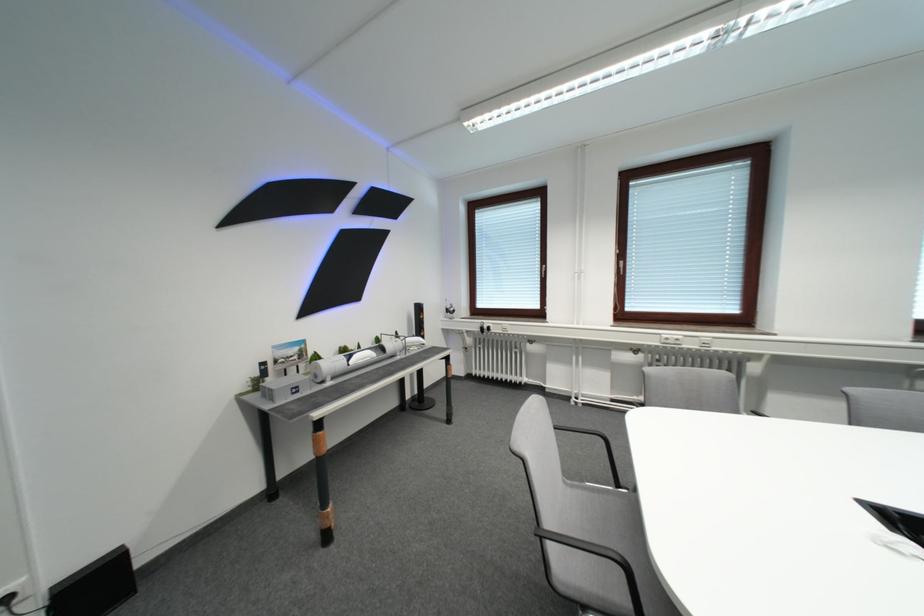
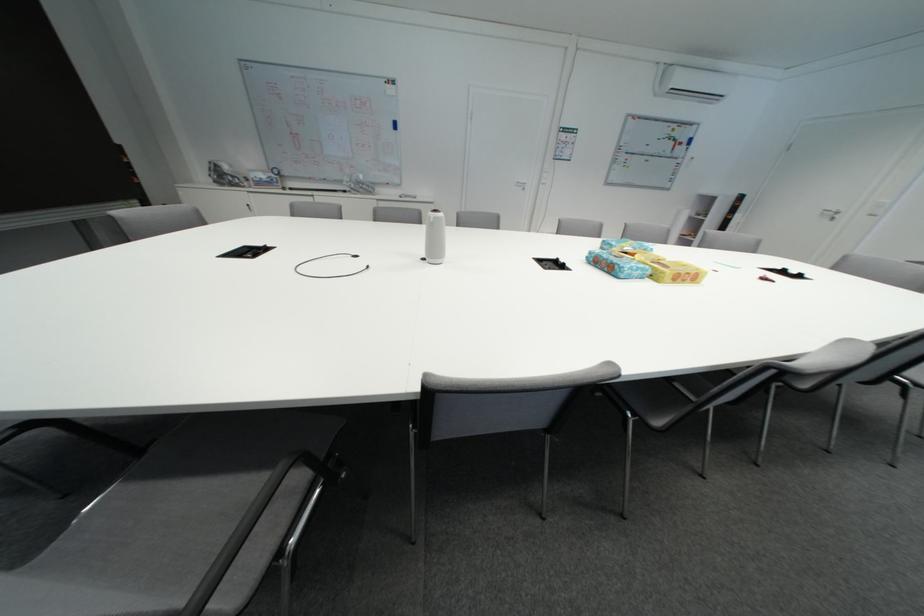
Question: I am providing you with two images of the same scene from different viewpoints. Which of the following objects are not visible in image2?

Choices:
 (A) grey chair sitting surface
 (B) microwave door button
 (C) black chair armrest
 (D) black marker

Answer: (C)